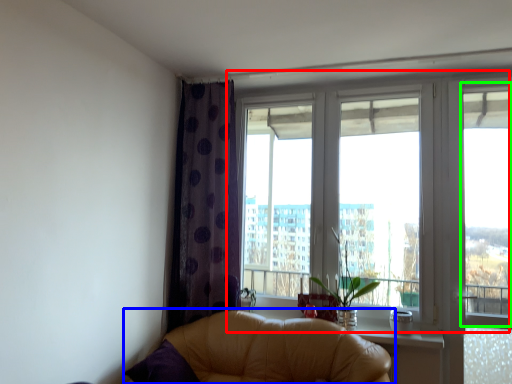
Question: Which object is the farthest from window (highlighted by a red box)? Choose among these: studio couch (highlighted by a blue box) or window screen (highlighted by a green box).

Choices:
 (A) studio couch
 (B) window screen

Answer: (A)